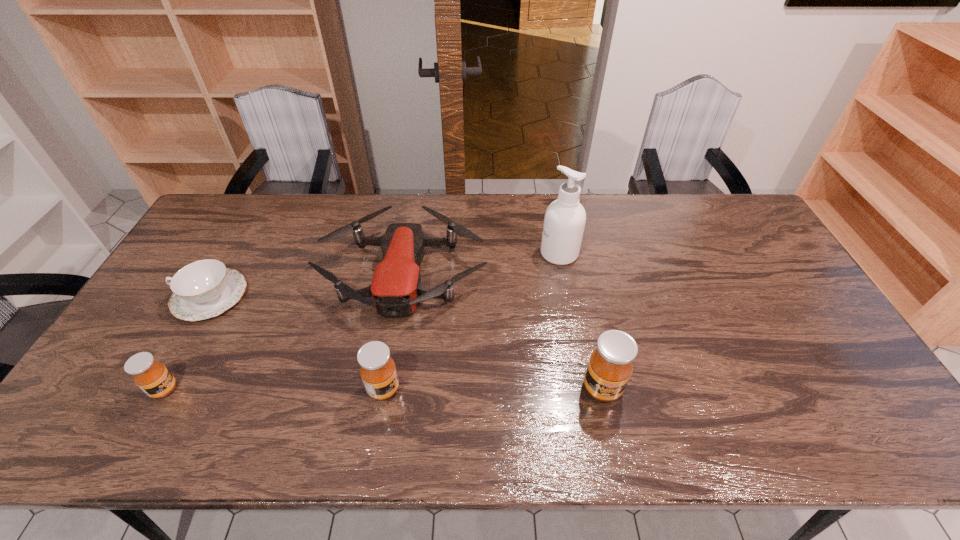
Observe the arrangement of all honeys in the image. To keep them evenly spaced, where would you place another honey on the right? Please locate a free space. Please provide its 2D coordinates. Your answer should be formatted as a tuple, i.e. [(x, y)], where the tuple contains the x and y coordinates of a point satisfying the conditions above.

[(820, 387)]